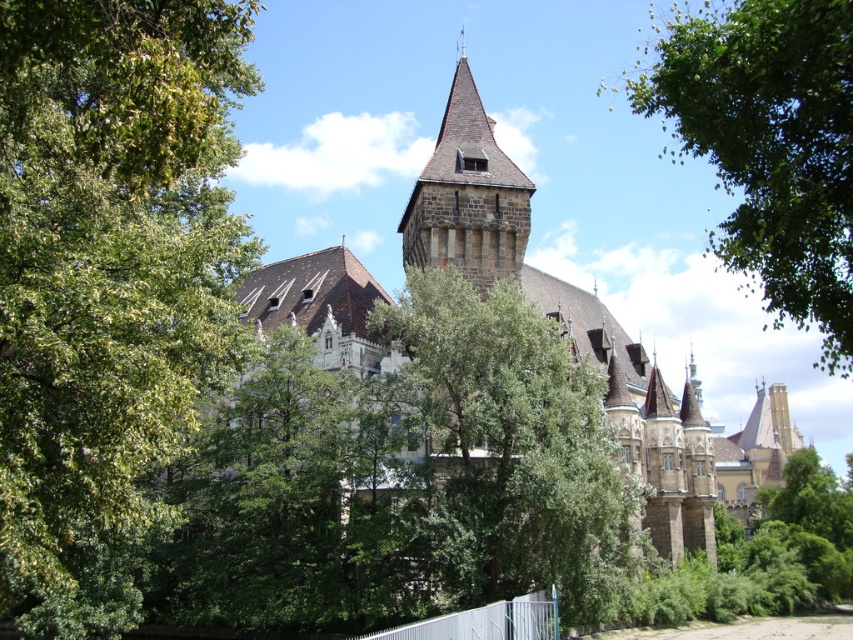
Question: Which point is closer to the camera?

Choices:
 (A) green leafy tree at upper left
 (B) green leafy tree at center

Answer: (A)

Question: Is green leafy tree at center positioned behind dark brown stone tower at center?

Choices:
 (A) yes
 (B) no

Answer: (B)

Question: Does green leafy tree at center appear on the left side of dark brown stone tower at center?

Choices:
 (A) yes
 (B) no

Answer: (B)

Question: Is green leafy tree at center thinner than green leafy tree at upper right?

Choices:
 (A) yes
 (B) no

Answer: (A)

Question: Which is farther from the brown tiled roof at center?

Choices:
 (A) green leafy tree at upper left
 (B) green leafy tree at center
 (C) dark brown stone tower at center

Answer: (A)

Question: Which of the following is the closest to the observer?

Choices:
 (A) (109, 104)
 (B) (479, 524)

Answer: (A)